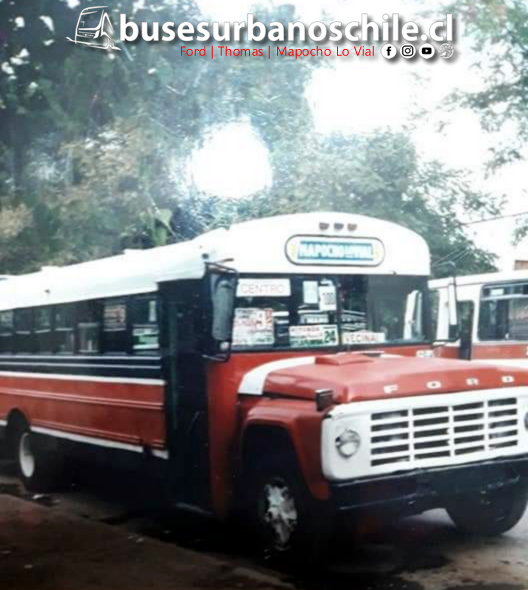
Identify the location of white grille. (450, 399).